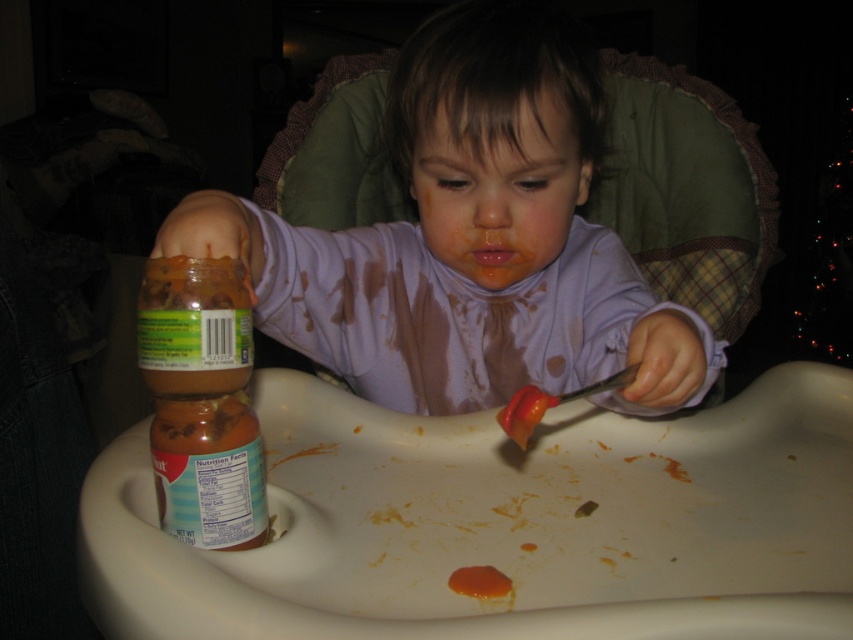
The child is sitting in a high chair with a white tray. You see a matte plastic baby at center and a smooth orange carrot at center. Which object is positioned higher?

The matte plastic baby at center is above the smooth orange carrot at center, so it is positioned higher.

You are a parent trying to hand your child the smooth orange carrot at center from the matte plastic baby at center. Can you place the carrot within reach of the child without moving the baby?

The matte plastic baby at center and smooth orange carrot at center are 9.50 inches apart. Since the distance between them is 9.50 inches, the carrot is already within reach of the child as typical children can reach about 12 inches. Therefore, you can place the carrot within reach without moving the baby.

You are a parent trying to clean up after your child. You see the matte plastic baby at center and the smooth orange carrot at center on the tray. Which item is closer to the left edge of the tray?

The matte plastic baby at center is positioned on the left side of smooth orange carrot at center, so it is closer to the left edge of the tray.